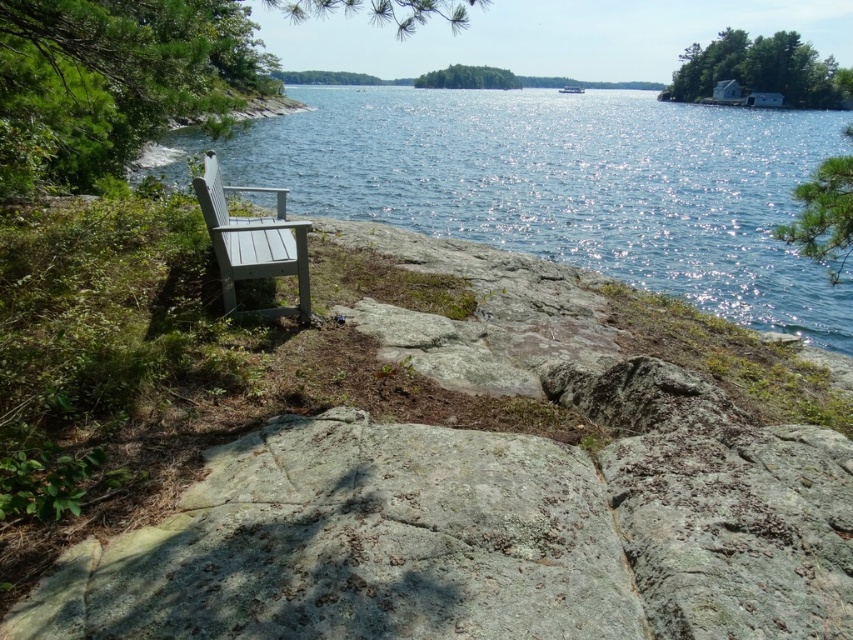
You are standing at the edge of the lake and want to place a small decorative rock between the two points marked as point (x=482, y=193) and point (x=227, y=220). Which point is closer to you so you can place the rock there first?

Point (x=482, y=193) is closer to you than point (x=227, y=220), so you should place the rock there first.

You are standing at the lakeside and want to place a small potted plant between the glistening blue water at center and the gray wood chair at center. Based on their positions, which object should the potted plant be closer to?

The glistening blue water at center is above the gray wood chair at center, so the potted plant should be placed closer to the gray wood chair at center to maintain balance between the two objects.

You are standing at the edge of the lake and see the glistening blue water at center. If you want to reach the water, how many steps would you need to take if each step covers 2 feet?

The glistening blue water at center is 14.69 feet away from the viewer. Since each step covers 2 feet, you would need approximately 7 to 8 steps to reach it.